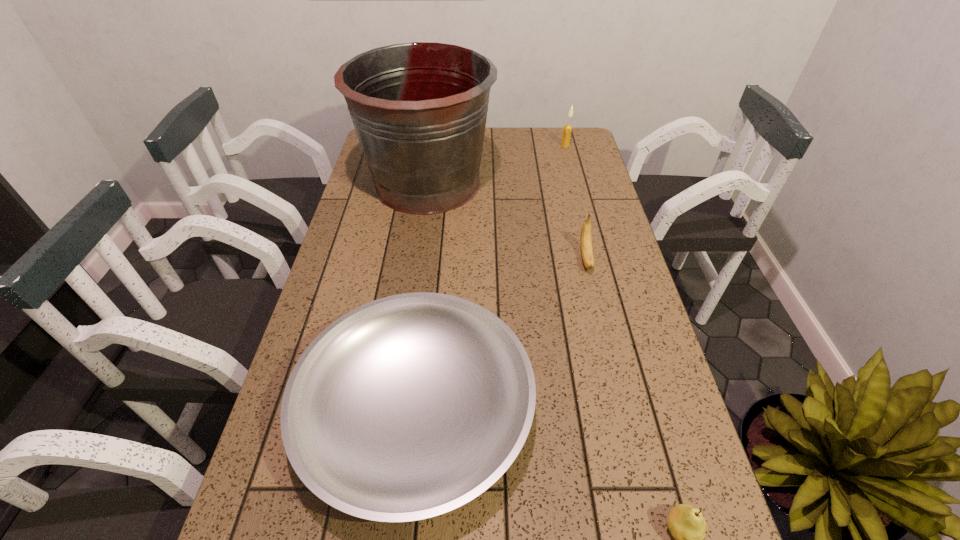
Locate an element on the screen. The height and width of the screenshot is (540, 960). candle positioned at the far edge is located at coordinates (567, 130).

I want to click on bucket that is at the left edge, so click(x=419, y=109).

Identify the location of bedpan present at the left edge. This screenshot has width=960, height=540. (408, 407).

Where is `candle positioned at the right edge`? The height and width of the screenshot is (540, 960). candle positioned at the right edge is located at coordinates (567, 130).

The width and height of the screenshot is (960, 540). What are the coordinates of `banana that is at the right edge` in the screenshot? It's located at (586, 238).

Identify the location of object that is at the far left corner. (419, 109).

This screenshot has width=960, height=540. I want to click on object that is positioned at the far right corner, so click(x=567, y=130).

Image resolution: width=960 pixels, height=540 pixels. Find the location of `free space at the far edge of the desktop`. free space at the far edge of the desktop is located at coordinates (523, 144).

Locate an element on the screen. This screenshot has width=960, height=540. free space at the left edge is located at coordinates (332, 285).

The width and height of the screenshot is (960, 540). What are the coordinates of `vacant space at the right edge of the desktop` in the screenshot? It's located at (600, 232).